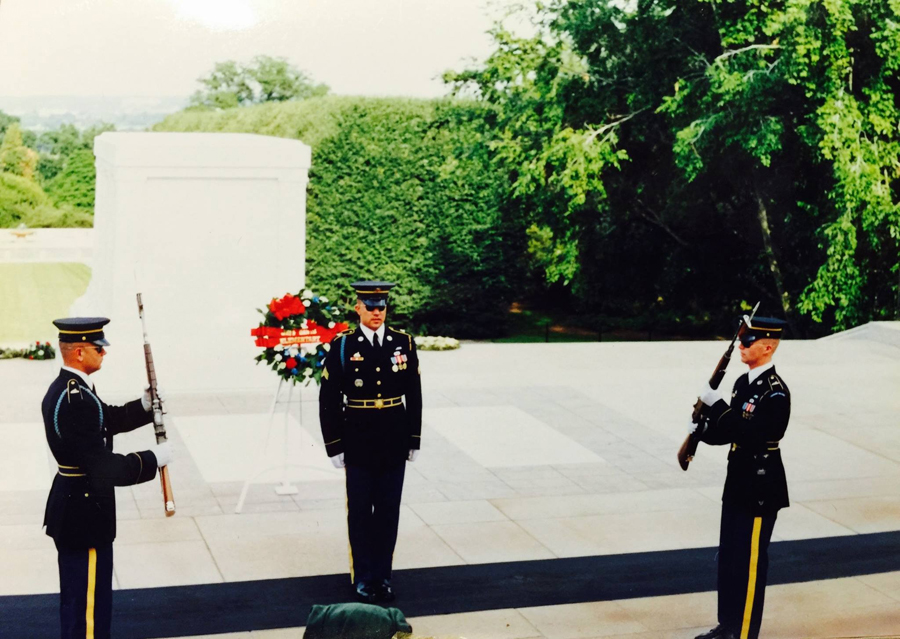
Where is `blue carpet`? blue carpet is located at coordinates (572, 583).